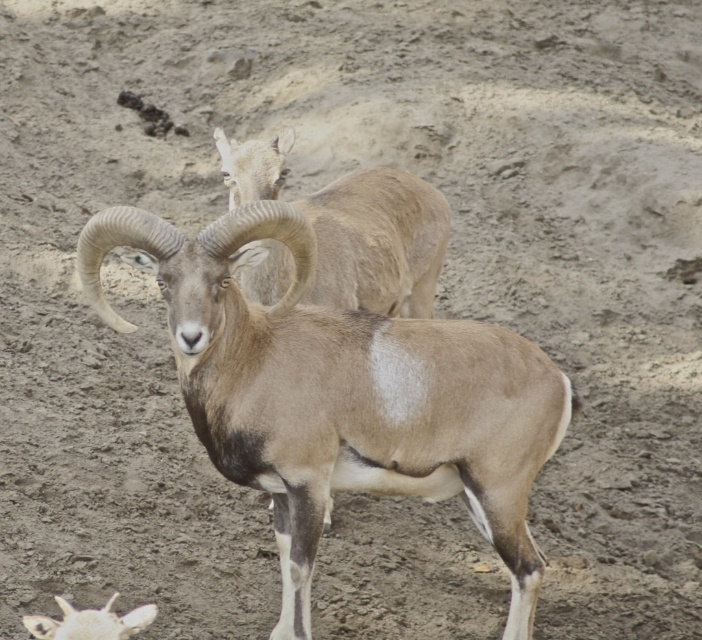
You are a wildlife photographer aiming to capture both the brown woolen goat at center and the white woolen sheep at lower left in a single frame. Based on their positions, which animal should you adjust your camera focus on first to ensure both are in the shot?

The brown woolen goat at center is to the right of the white woolen sheep at lower left. Since the white woolen sheep at lower left is closer to the camera, you should focus on it first to ensure both are in the frame.

You are a hiker trying to take a photo of both the brown woolen goat at center and the light brown woolen goat at upper center. Which goat should you focus on first to ensure both are in the frame?

You should focus on the light brown woolen goat at upper center first because the brown woolen goat at center is in front of it, so adjusting the focus to include the background goat might require a wider focus range.